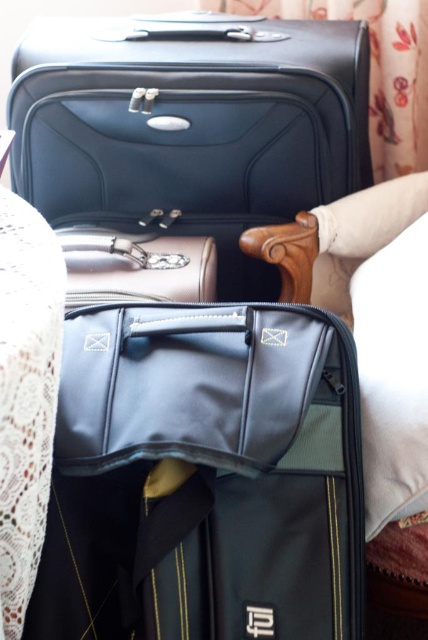
Is the position of matte black bag at center more distant than that of white soft pillow at right?

That is False.

Can you confirm if matte black bag at center is positioned above white soft pillow at right?

Actually, matte black bag at center is below white soft pillow at right.

This screenshot has height=640, width=428. I want to click on matte black bag at center, so click(186, 384).

Where is `matte black bag at center`? matte black bag at center is located at coordinates pos(186,384).

Is point (366, 451) less distant than point (187, 285)?

Yes.

This screenshot has width=428, height=640. What are the coordinates of `white soft pillow at right` in the screenshot? It's located at (392, 376).

Does matte black suitcase at upper center appear under matte black bag at center?

No.

Between matte black suitcase at upper center and matte black bag at center, which one has more height?

matte black suitcase at upper center

Does point (282, 93) come farther from viewer compared to point (225, 412)?

Yes, it is behind point (225, 412).

Locate an element on the screen. The image size is (428, 640). matte black suitcase at upper center is located at coordinates (190, 129).